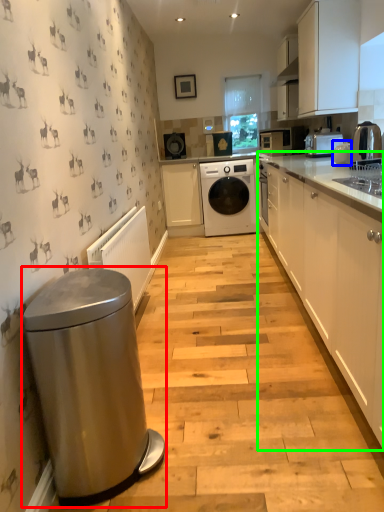
Question: Estimate the real-world distances between objects in this image. Which object is closer to water heater (highlighted by a red box), appliance (highlighted by a blue box) or cabinetry (highlighted by a green box)?

Choices:
 (A) appliance
 (B) cabinetry

Answer: (B)